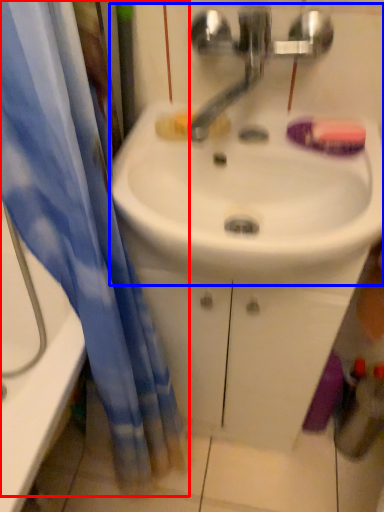
Question: Which of the following is the farthest to the observer, curtain (highlighted by a red box) or sink (highlighted by a blue box)?

Choices:
 (A) curtain
 (B) sink

Answer: (B)